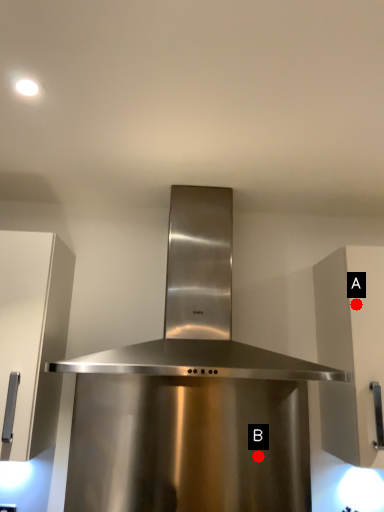
Question: Two points are circled on the image, labeled by A and B beside each circle. Which point appears closest to the camera in this image?

Choices:
 (A) A is closer
 (B) B is closer

Answer: (A)